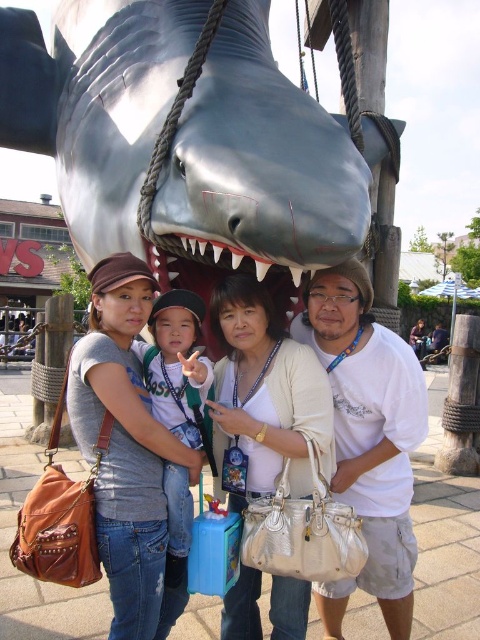
Between point (354, 326) and point (137, 477), which one is positioned in front?

Point (137, 477)

The image size is (480, 640). What do you see at coordinates (368, 436) in the screenshot?
I see `white matte jaw at center` at bounding box center [368, 436].

Who is more forward, (355, 380) or (133, 456)?

Point (133, 456) is more forward.

Find the location of a particular element. The width and height of the screenshot is (480, 640). white matte jaw at center is located at coordinates (368, 436).

Between white matte jaw at center and matte gray shark at upper center, which one appears on the left side from the viewer's perspective?

Positioned to the left is matte gray shark at upper center.

Between white matte jaw at center and matte gray shark at upper center, which one appears on the right side from the viewer's perspective?

From the viewer's perspective, white matte jaw at center appears more on the right side.

Is point (398, 528) in front of point (0, 348)?

Yes, point (398, 528) is in front of point (0, 348).

I want to click on white matte jaw at center, so click(368, 436).

In the scene shown: Which of these two, shiny metallic shark at center or matte gray shark at upper center, stands taller?

shiny metallic shark at center

Does shiny metallic shark at center have a greater width compared to matte gray shark at upper center?

No.

Find the location of a particular element. shiny metallic shark at center is located at coordinates (262, 161).

You are a GUI agent. You are given a task and a screenshot of the screen. Output one action in this format:
    pyautogui.click(x=<x>, y=<y>)
    Task: Click on the shiny metallic shark at center
    
    Given the screenshot: What is the action you would take?
    pyautogui.click(x=262, y=161)